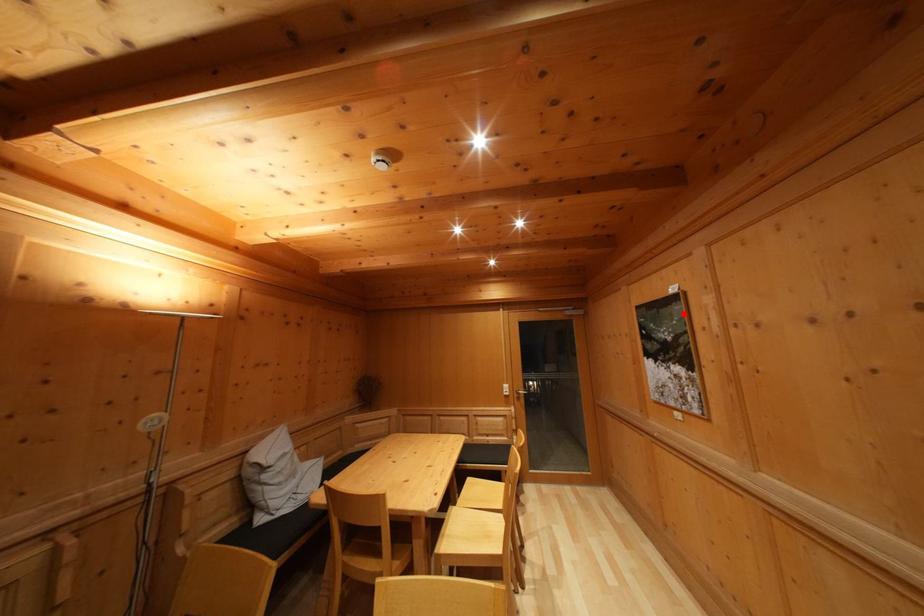
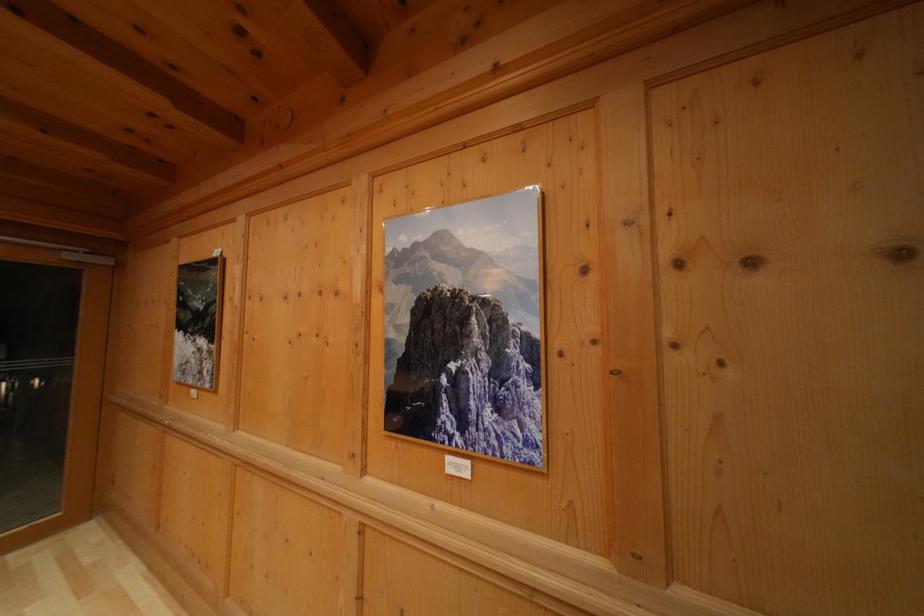
Locate, in the second image, the point that corresponds to the highlighted location in the first image.

(222, 281)